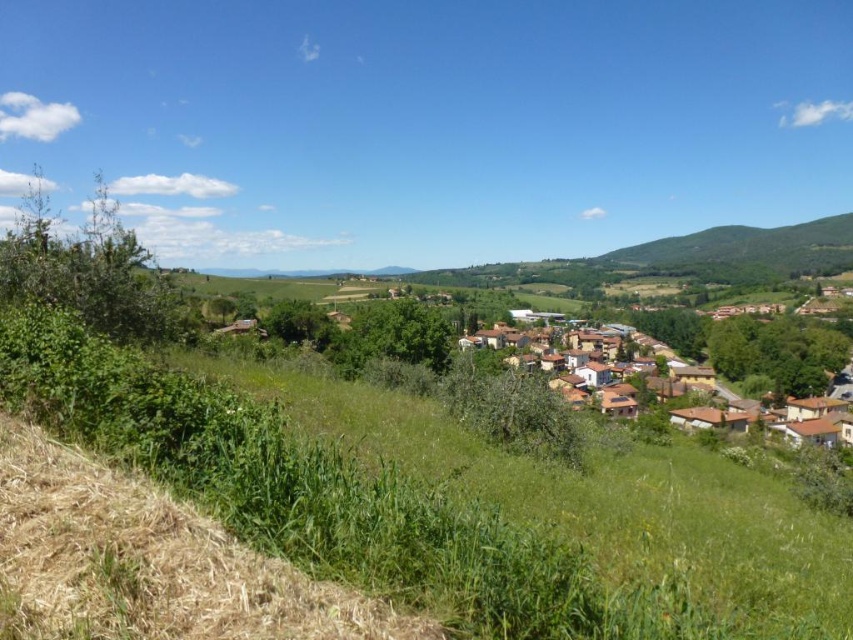
Question: Can you confirm if green grassy hillside at lower left is bigger than brown tiled roofs at center?

Choices:
 (A) yes
 (B) no

Answer: (B)

Question: Which object is closer to the camera taking this photo?

Choices:
 (A) brown tiled roofs at center
 (B) brown dry grass at lower left
 (C) green grassy hillside at right
 (D) green grassy hillside at lower left

Answer: (B)

Question: Which point is farther from the camera taking this photo?

Choices:
 (A) (577, 474)
 (B) (804, 372)
 (C) (22, 448)

Answer: (B)

Question: Which object is positioned farthest from the green grassy hillside at right?

Choices:
 (A) green grassy hillside at lower left
 (B) brown tiled roofs at center

Answer: (A)

Question: Is green grassy hillside at lower left bigger than brown dry grass at lower left?

Choices:
 (A) no
 (B) yes

Answer: (B)

Question: Considering the relative positions of brown dry grass at lower left and brown tiled roofs at center in the image provided, where is brown dry grass at lower left located with respect to brown tiled roofs at center?

Choices:
 (A) right
 (B) left

Answer: (B)